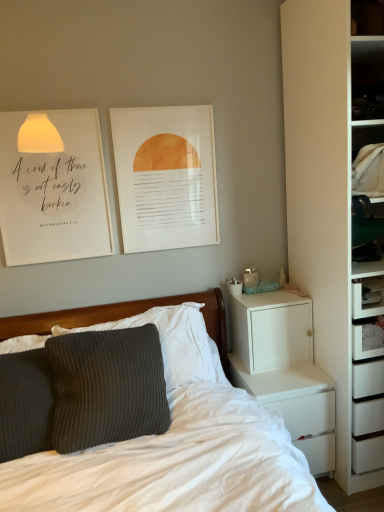
You are a GUI agent. You are given a task and a screenshot of the screen. Output one action in this format:
    pyautogui.click(x=<x>, y=<y>)
    Task: Click on the empty space that is ontop of white matte cabinet at right (from a real-world perspective)
    
    Given the screenshot: What is the action you would take?
    pyautogui.click(x=261, y=292)